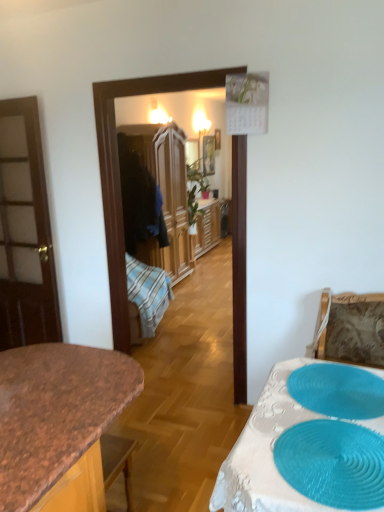
Locate an element on the screen. free location above blue textured placemat at lower right, marked as the 2th oval in a front-to-back arrangement (from a real-world perspective) is located at coordinates (342, 387).